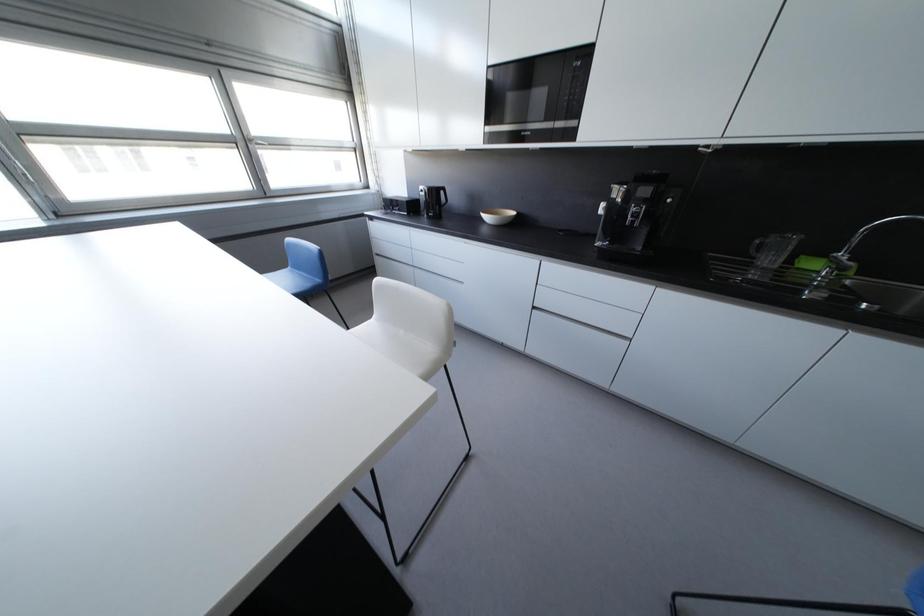
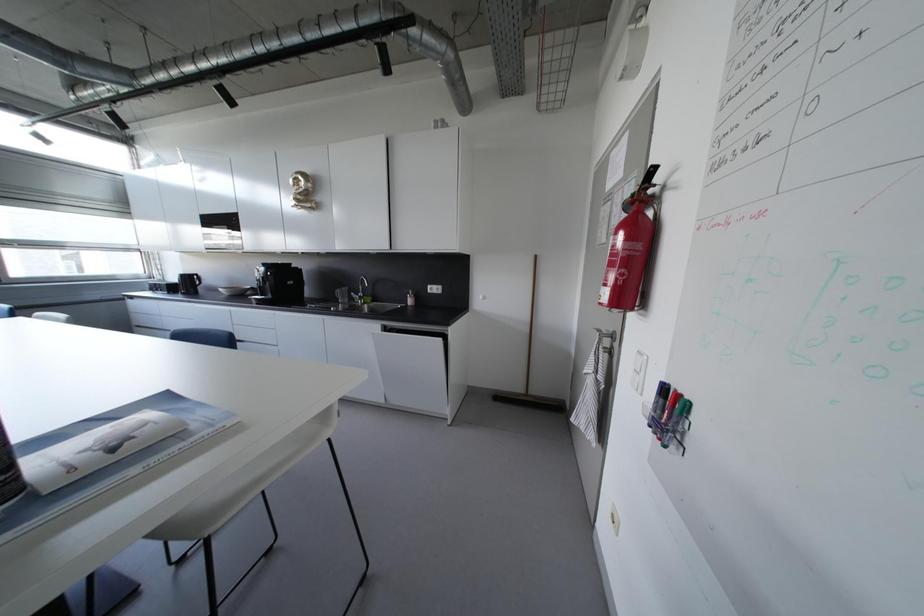
The images are taken continuously from a first-person perspective. In which direction are you moving?

The movement direction of the cameraman is right, backward.